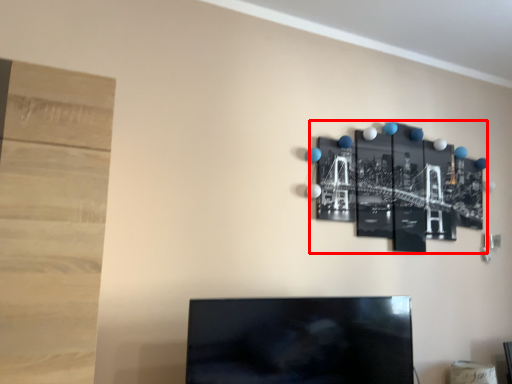
Question: Observing the image, what is the correct spatial positioning of bulletin board (annotated by the red box) in reference to television?

Choices:
 (A) right
 (B) left

Answer: (A)